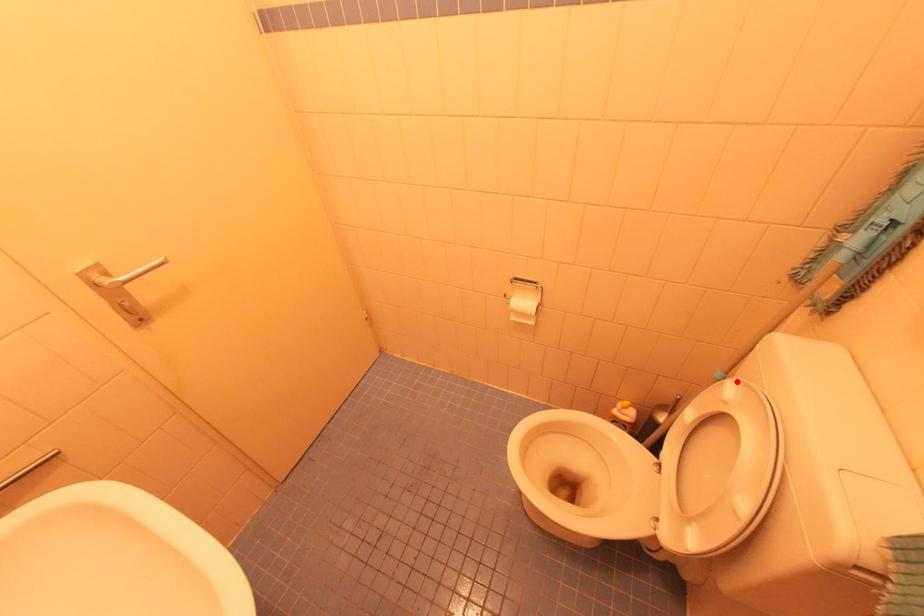
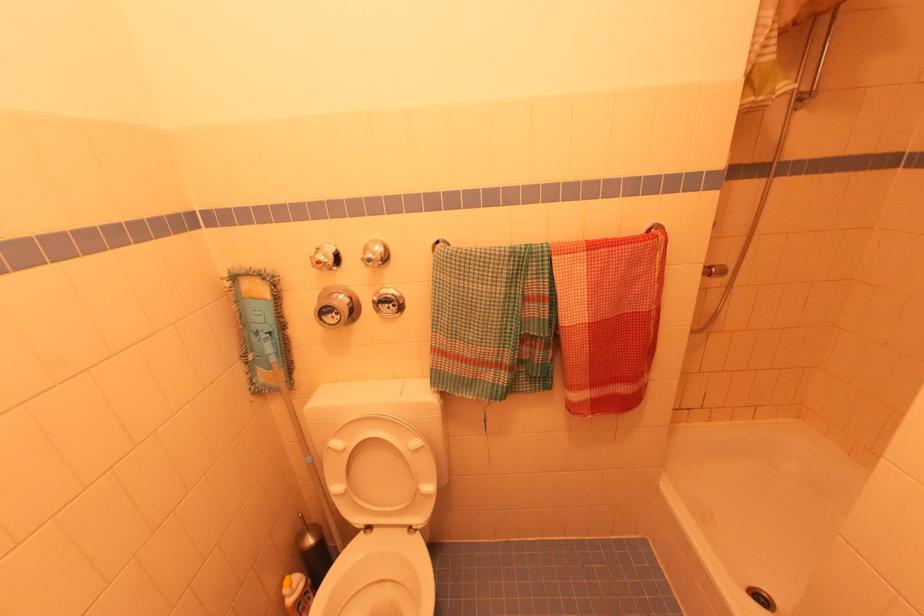
Question: A red point is marked in image1. In image2, is the corresponding 3D point closer to the camera or farther? Reply with the corresponding letter.

Choices:
 (A) The corresponding 3D point is closer.
 (B) The corresponding 3D point is farther.

Answer: (B)